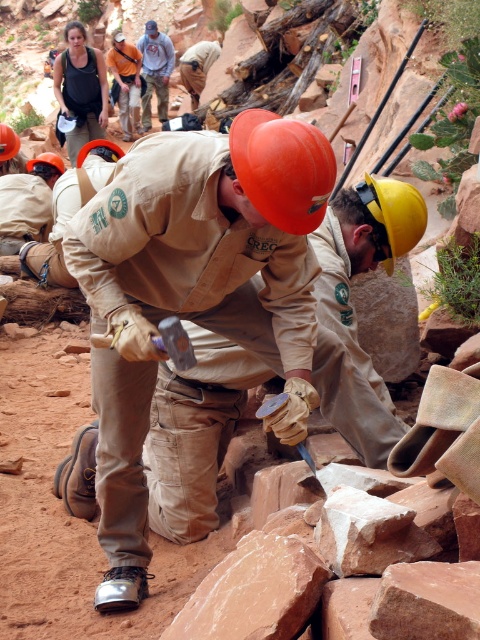
You are a safety inspector reviewing this work site. You notice an orange cotton shirt at upper center and an orange matte helmet at upper center. According to safety protocols, which item should be positioned above the other?

The orange cotton shirt at upper center should be positioned above the orange matte helmet at upper center because the shirt is part of the worker clothing and the helmet is worn on the head, which naturally places the shirt below the helmet. However, according to the description, the orange cotton shirt at upper center is located above the orange matte helmet at upper center, which is an unusual and unsafe situation that requires immediate attention.